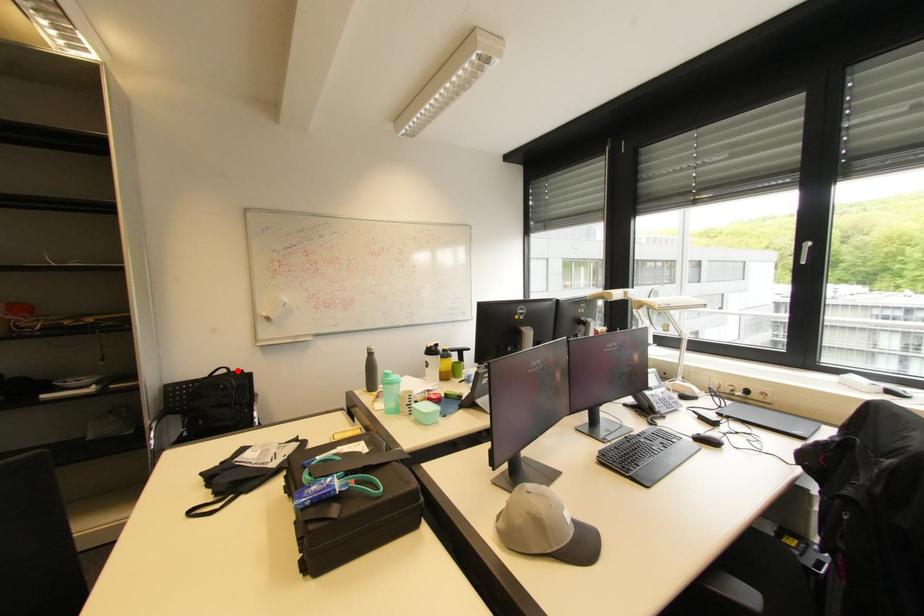
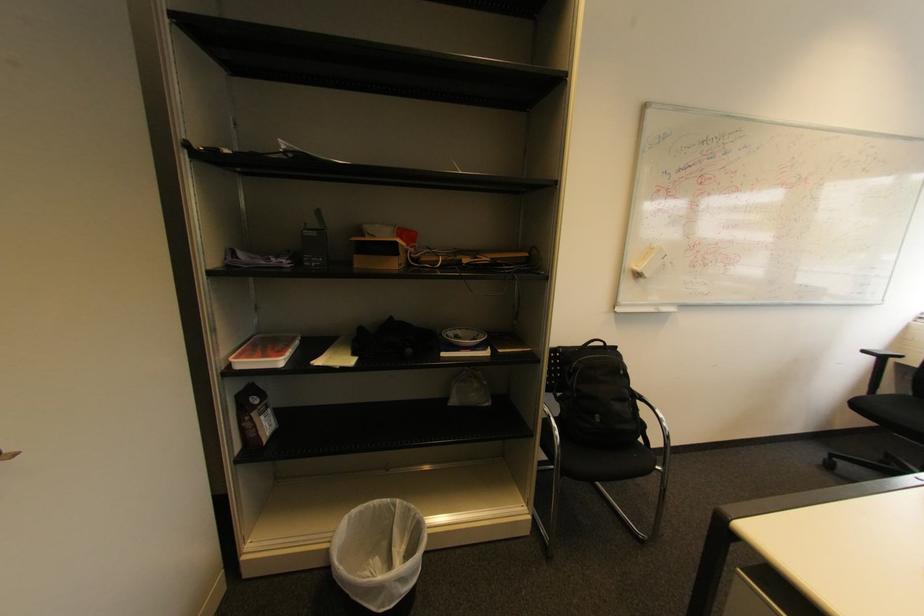
Where in the second image is the point corresponding to the highlighted location from the first image?

(613, 345)